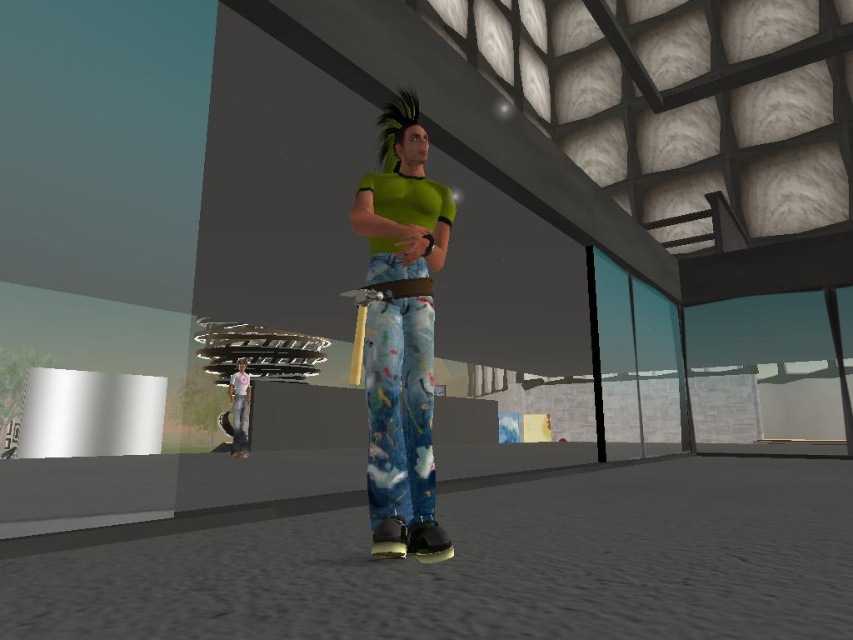
Between point (374, 252) and point (241, 385), which one is positioned behind?

Point (241, 385)

Who is higher up, painted denim pants at center or light blue denim pants at lower left?

painted denim pants at center is higher up.

At what (x,y) coordinates should I click in order to perform the action: click on painted denim pants at center. Please return your answer as a coordinate pair (x, y). The width and height of the screenshot is (853, 640). Looking at the image, I should click on (401, 428).

Between green spiky hair at center and light blue denim pants at lower left, which one is positioned higher?

green spiky hair at center

Between green spiky hair at center and light blue denim pants at lower left, which one appears on the right side from the viewer's perspective?

green spiky hair at center

Does point (393, 148) lie behind point (242, 412)?

No, it is not.

Image resolution: width=853 pixels, height=640 pixels. In order to click on green spiky hair at center in this screenshot , I will do `click(395, 125)`.

Between painted denim pants at center and green spiky hair at center, which one is positioned lower?

painted denim pants at center is lower down.

Is painted denim pants at center bigger than green spiky hair at center?

Indeed, painted denim pants at center has a larger size compared to green spiky hair at center.

Where is `painted denim pants at center`? The height and width of the screenshot is (640, 853). painted denim pants at center is located at coordinates (401, 428).